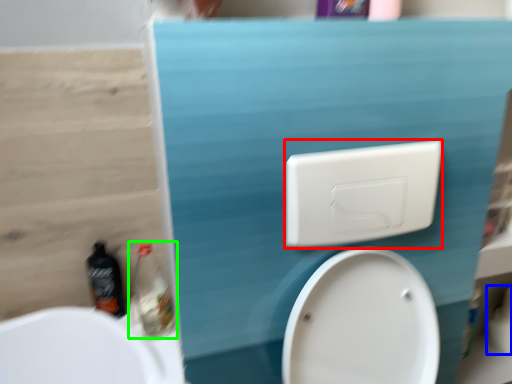
Question: Based on their relative distances, which object is farther from light switch (highlighted by a red box)? Choose from toilet paper (highlighted by a blue box) and cleaning product (highlighted by a green box).

Choices:
 (A) toilet paper
 (B) cleaning product

Answer: (A)